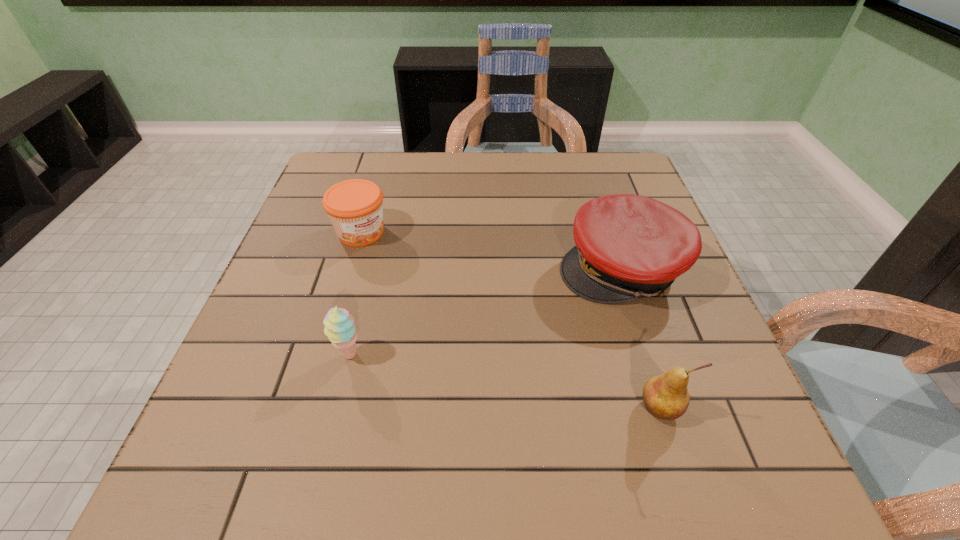
Locate an element on the screen. The width and height of the screenshot is (960, 540). free space on the desktop that is between the third farthest object and the nearest object and is positioned on the front label of the jam is located at coordinates (535, 386).

Where is `vacant spot on the desktop that is between the second nearest object and the nearest object and is positioned on the front of the cap with an emblem`? Image resolution: width=960 pixels, height=540 pixels. vacant spot on the desktop that is between the second nearest object and the nearest object and is positioned on the front of the cap with an emblem is located at coordinates (458, 373).